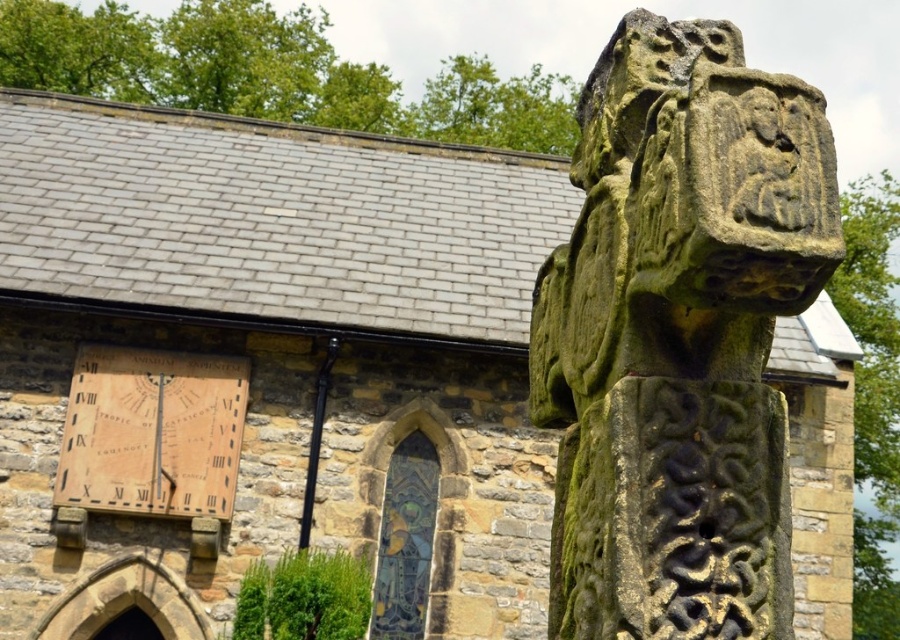
Question: Can you confirm if green mossy stone cross at upper right is wider than wooden sundial at left?

Choices:
 (A) no
 (B) yes

Answer: (A)

Question: Is green mossy stone cross at upper right positioned in front of wooden sundial at left?

Choices:
 (A) yes
 (B) no

Answer: (A)

Question: Is green mossy stone cross at upper right to the right of wooden sundial at left from the viewer's perspective?

Choices:
 (A) no
 (B) yes

Answer: (B)

Question: Which object is closer to the camera taking this photo?

Choices:
 (A) green mossy stone cross at upper right
 (B) wooden sundial at left

Answer: (A)

Question: Among these objects, which one is farthest from the camera?

Choices:
 (A) green mossy stone cross at upper right
 (B) wooden sundial at left

Answer: (B)

Question: Among these points, which one is nearest to the camera?

Choices:
 (A) pyautogui.click(x=162, y=435)
 (B) pyautogui.click(x=775, y=189)

Answer: (B)